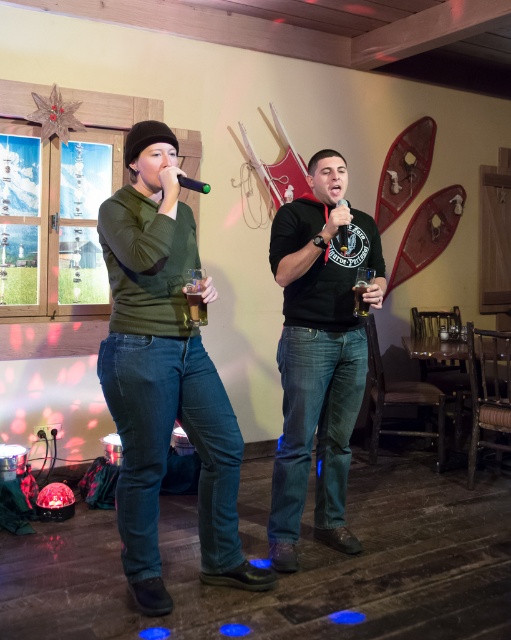
Question: Which object appears farthest from the camera in this image?

Choices:
 (A) translucent glass beer at center
 (B) translucent glass at center

Answer: (A)

Question: Considering the real-world distances, which object is closest to the black matte t-shirt at center?

Choices:
 (A) translucent glass at center
 (B) green matte shirt at center

Answer: (B)

Question: Estimate the real-world distances between objects in this image. Which object is closer to the translucent glass beer at center?

Choices:
 (A) black matte t-shirt at center
 (B) translucent glass at center
 (C) green matte shirt at center

Answer: (A)

Question: Can you confirm if green matte shirt at center is positioned above black matte t-shirt at center?

Choices:
 (A) yes
 (B) no

Answer: (B)

Question: Is black matte t-shirt at center to the left of translucent glass beer at center from the viewer's perspective?

Choices:
 (A) no
 (B) yes

Answer: (B)

Question: Is green matte shirt at center behind translucent glass at center?

Choices:
 (A) yes
 (B) no

Answer: (B)